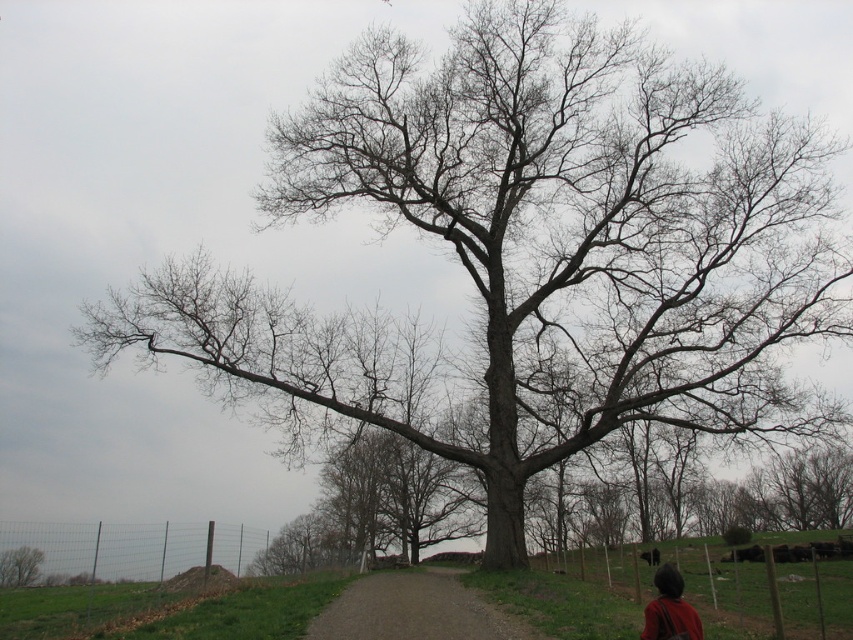
Does brown leather backpack at lower right have a lesser height compared to bare wood tree at lower left?

Incorrect, brown leather backpack at lower right's height does not fall short of bare wood tree at lower left's.

Image resolution: width=853 pixels, height=640 pixels. What do you see at coordinates (669, 609) in the screenshot?
I see `brown leather backpack at lower right` at bounding box center [669, 609].

Find the location of a particular element. Image resolution: width=853 pixels, height=640 pixels. brown leather backpack at lower right is located at coordinates (669, 609).

Can you confirm if dirt/gravel path at center is thinner than bare wood tree at lower left?

No, dirt/gravel path at center is not thinner than bare wood tree at lower left.

Identify the location of dirt/gravel path at center. This screenshot has height=640, width=853. (415, 609).

Based on the photo, does dirt/gravel path at center appear on the left side of brown leather backpack at lower right?

Correct, you'll find dirt/gravel path at center to the left of brown leather backpack at lower right.

Is dirt/gravel path at center in front of brown leather backpack at lower right?

No.

This screenshot has width=853, height=640. Identify the location of dirt/gravel path at center. (415, 609).